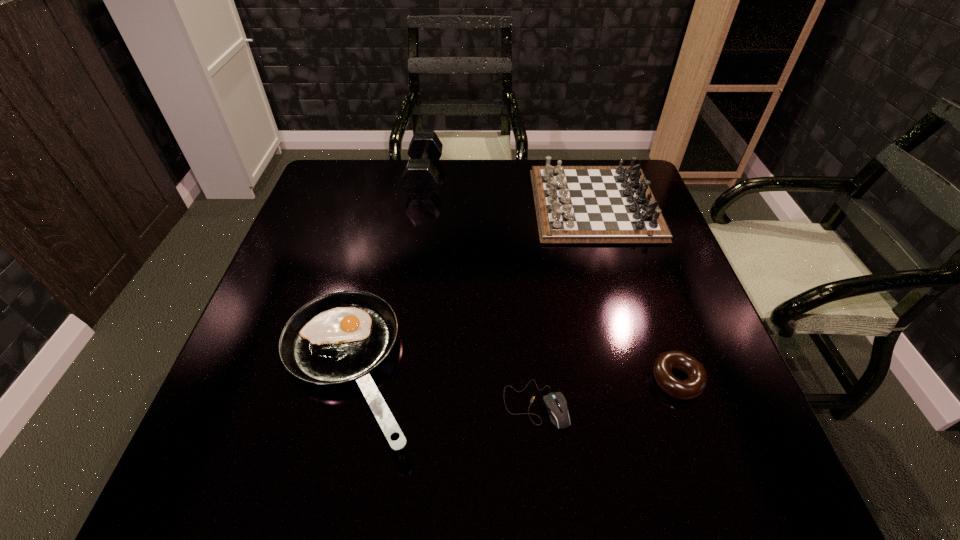
Image resolution: width=960 pixels, height=540 pixels. What are the coordinates of `vacant point that satisfies the following two spatial constraints: 1. from the player's perspective of the chessboard; 2. on the front side of the third tallest object` in the screenshot? It's located at (644, 370).